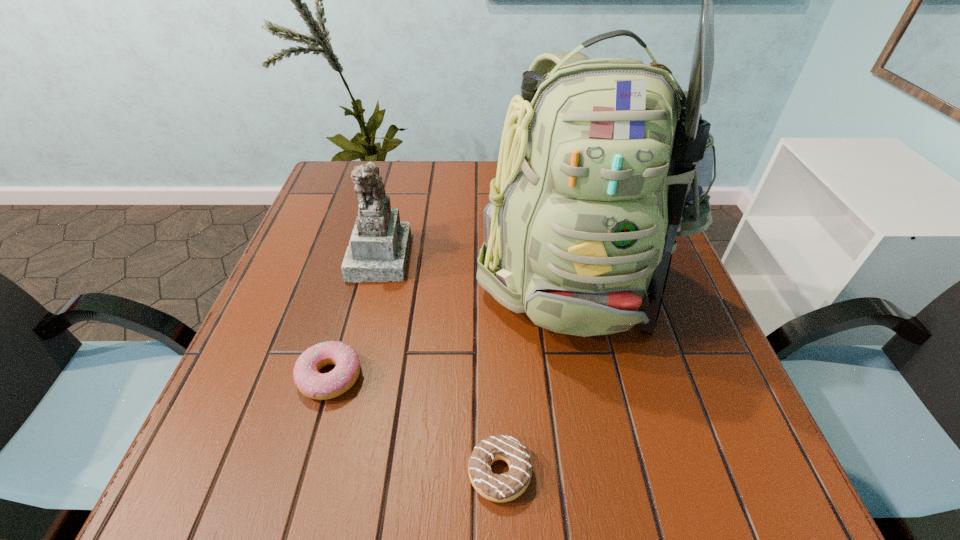
This screenshot has height=540, width=960. Identify the location of backpack. (603, 162).

Identify the location of figurine. This screenshot has width=960, height=540. (378, 249).

You are a GUI agent. You are given a task and a screenshot of the screen. Output one action in this format:
    pyautogui.click(x=<x>, y=<y>)
    Task: Click on the farther doughnut
    This screenshot has width=960, height=540.
    Given the screenshot: What is the action you would take?
    pyautogui.click(x=311, y=383)

You are a GUI agent. You are given a task and a screenshot of the screen. Output one action in this format:
    pyautogui.click(x=<x>, y=<y>)
    Task: Click on the taller doughnut
    The image size is (960, 540).
    Given the screenshot: What is the action you would take?
    pyautogui.click(x=311, y=383)

Image resolution: width=960 pixels, height=540 pixels. I want to click on the right doughnut, so click(x=508, y=486).

Where is `the shortest object`? the shortest object is located at coordinates (508, 486).

Locate an element on the screen. This screenshot has height=540, width=960. free space located 0.210m on the front-facing side of the tallest object is located at coordinates (618, 478).

At what (x,y) coordinates should I click in order to perform the action: click on free location located on the front-facing side of the second tallest object. Please return your answer as a coordinate pair (x, y). Looking at the image, I should click on (452, 255).

Where is `vacant space located on the back of the third tallest object`? vacant space located on the back of the third tallest object is located at coordinates (351, 304).

At what (x,y) coordinates should I click in order to perform the action: click on vacant space located on the right of the nearest object. Please return your answer as a coordinate pair (x, y). This screenshot has height=540, width=960. Looking at the image, I should click on (597, 473).